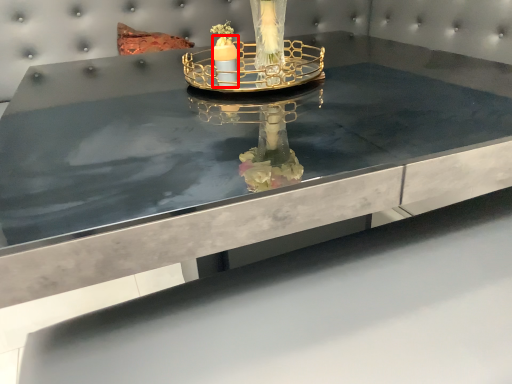
Question: From the image's perspective, where is candle (annotated by the red box) located relative to candle holder?

Choices:
 (A) below
 (B) above

Answer: (A)